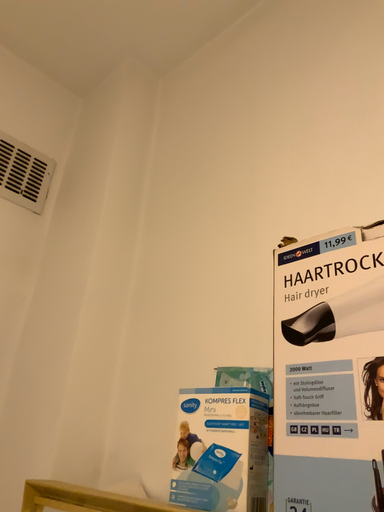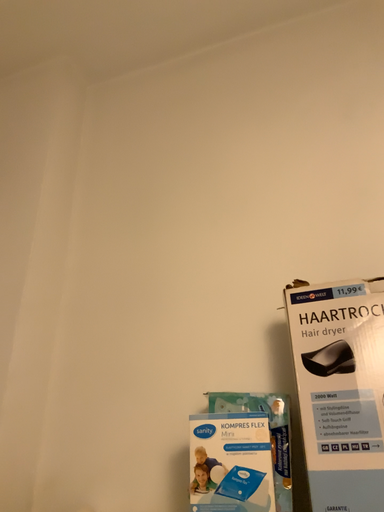
Question: How did the camera likely rotate when shooting the video?

Choices:
 (A) rotated right
 (B) rotated left

Answer: (A)